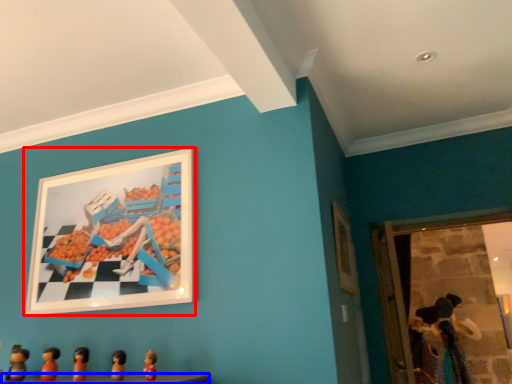
Question: Which of the following is the closest to the observer, picture frame (highlighted by a red box) or table (highlighted by a blue box)?

Choices:
 (A) picture frame
 (B) table

Answer: (B)